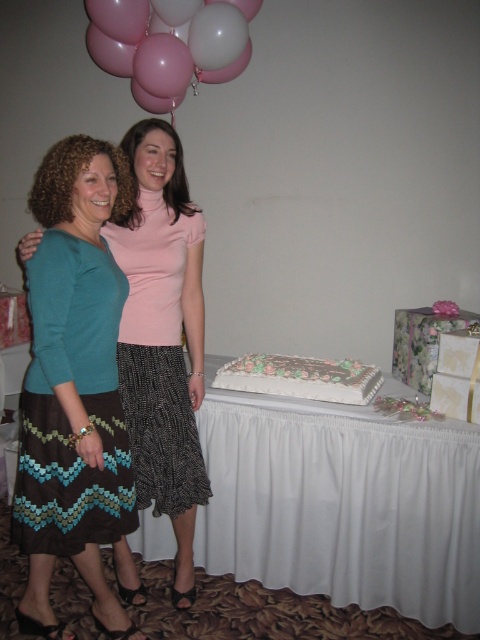
You are standing in the same room as the two women and want to place a small gift box on the table behind the brown zigzag skirt at left. Can you estimate whether the gift box will be visible to someone looking directly at the women?

The brown zigzag skirt at left is positioned at point (80, 397), which is likely close to the table. Since the table is behind the skirt, the gift box placed there might be partially or fully obscured depending on the skirt and table arrangement. However, without specific spatial relations between the skirt and table, it is uncertain if the gift box will be visible.